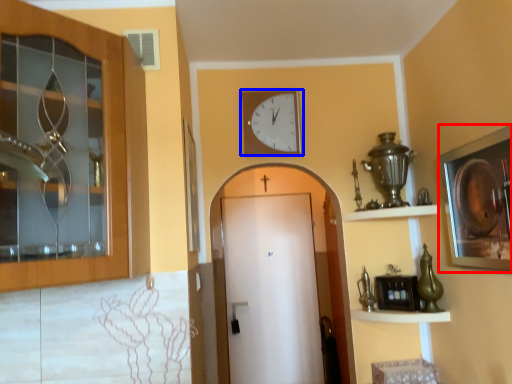
Question: Which object appears closest to the camera in this image, picture frame (highlighted by a red box) or wall clock (highlighted by a blue box)?

Choices:
 (A) picture frame
 (B) wall clock

Answer: (A)